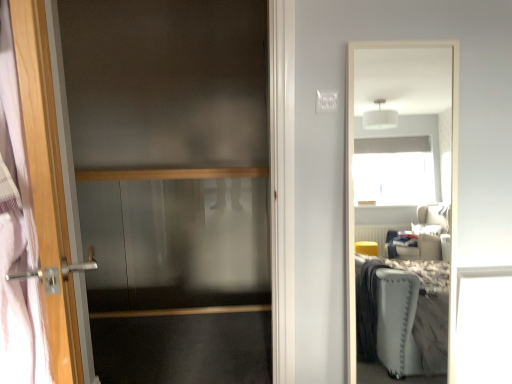
Question: Does point coord(45,134) appear closer or farther from the camera than point coord(192,72)?

Choices:
 (A) closer
 (B) farther

Answer: (A)

Question: Considering their positions, is wooden door handle at left located in front of or behind transparent glass screen door at left?

Choices:
 (A) front
 (B) behind

Answer: (A)

Question: Which is nearer to the transparent glass screen door at left?

Choices:
 (A) wooden door handle at left
 (B) satin wood balustrade at center

Answer: (B)

Question: Considering the real-world distances, which object is farthest from the satin wood balustrade at center?

Choices:
 (A) transparent glass screen door at left
 (B) wooden door handle at left

Answer: (B)